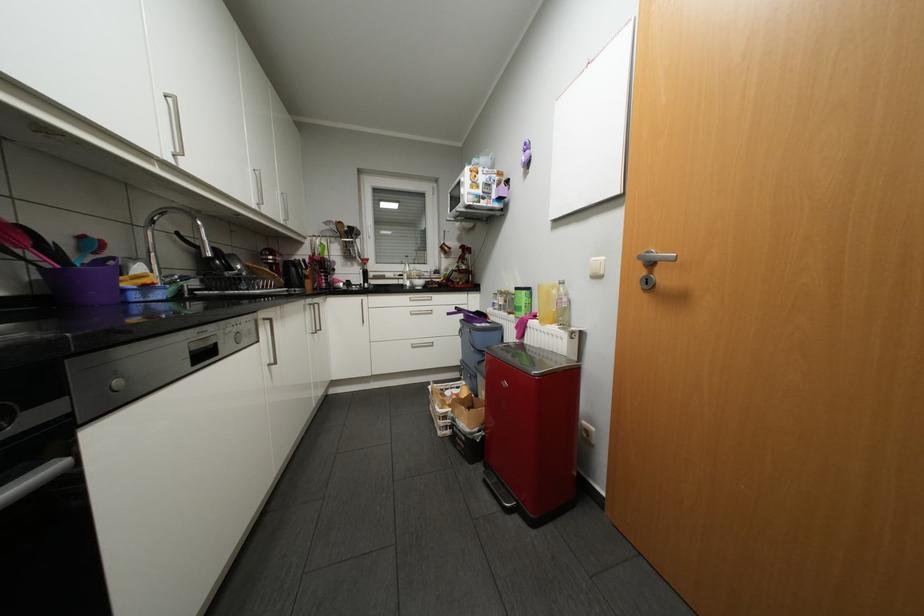
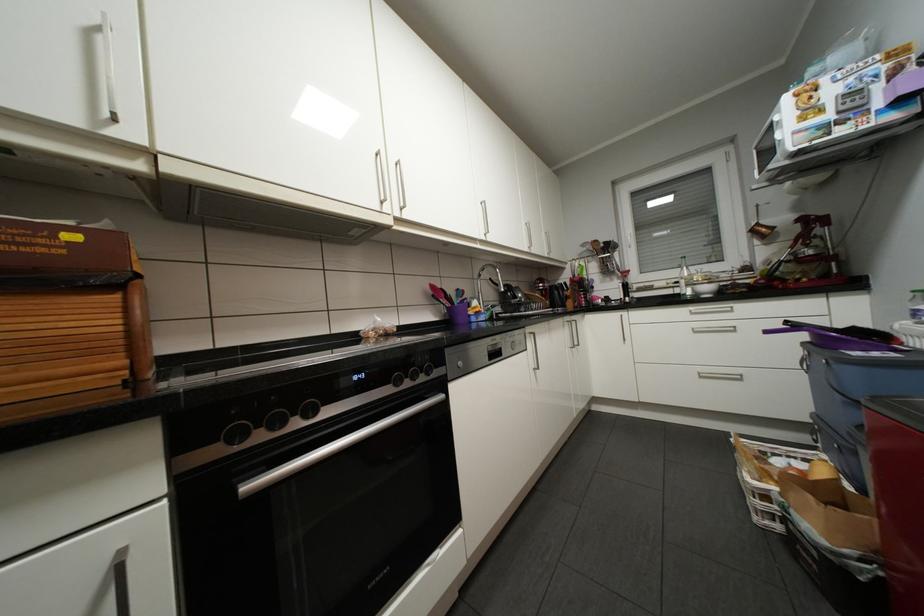
The point at (x=312, y=309) is marked in the first image. Where is the corresponding point in the second image?

(572, 325)